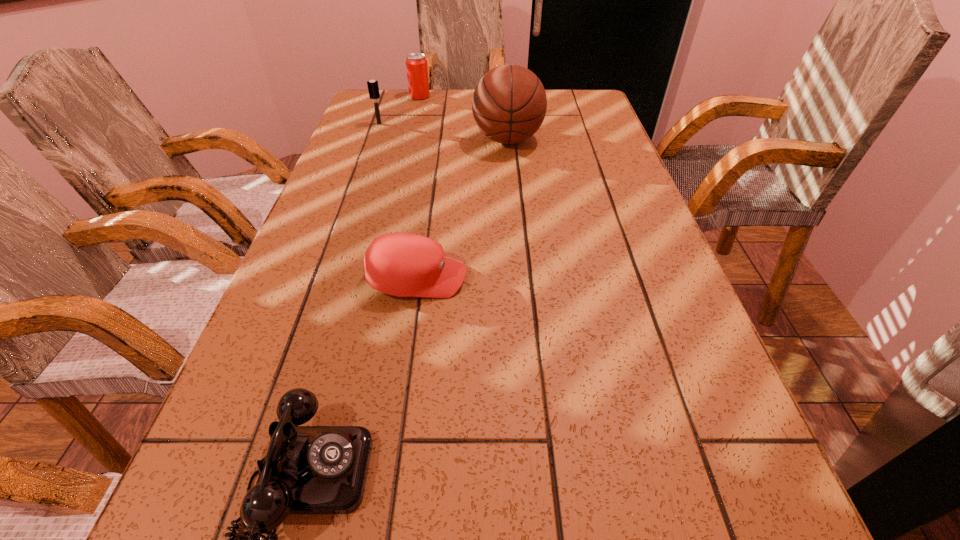
This screenshot has height=540, width=960. I want to click on the rightmost object, so click(509, 104).

Identify the location of the tallest object. (509, 104).

The width and height of the screenshot is (960, 540). In order to click on can in this screenshot , I will do [x=416, y=64].

Locate an element on the screen. hairbrush is located at coordinates (373, 87).

This screenshot has width=960, height=540. In order to click on cap in this screenshot , I will do `click(400, 264)`.

Find the location of a particular element. The height and width of the screenshot is (540, 960). vacant space located 0.260m on the side with brand label of the tallest object is located at coordinates (385, 140).

The image size is (960, 540). Find the location of `free space located 0.300m on the side with brand label of the tallest object`. free space located 0.300m on the side with brand label of the tallest object is located at coordinates (372, 140).

Where is `vacant space situated on the side with brand label of the tallest object`? The width and height of the screenshot is (960, 540). vacant space situated on the side with brand label of the tallest object is located at coordinates (429, 140).

What are the coordinates of `vacant area situated 0.400m on the front of the farthest object` in the screenshot? It's located at (404, 162).

You are a GUI agent. You are given a task and a screenshot of the screen. Output one action in this format:
    pyautogui.click(x=<x>, y=<y>)
    Task: Click on the vacant position located on the back of the hairbrush
    This screenshot has height=540, width=960.
    Given the screenshot: What is the action you would take?
    pyautogui.click(x=384, y=110)